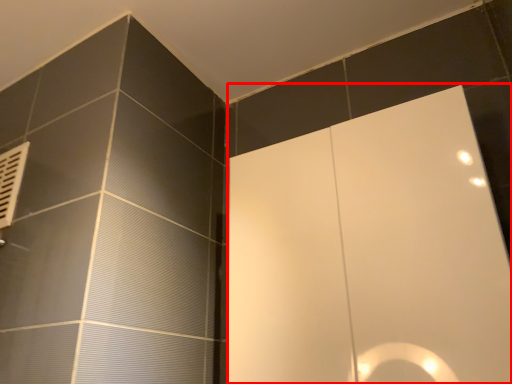
Question: Observing the image, what is the correct spatial positioning of screen door (annotated by the red box) in reference to air conditioner?

Choices:
 (A) left
 (B) right

Answer: (B)